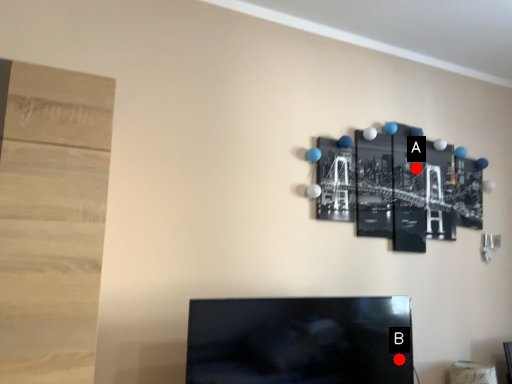
Question: Two points are circled on the image, labeled by A and B beside each circle. Which point is closer to the camera taking this photo?

Choices:
 (A) A is closer
 (B) B is closer

Answer: (B)